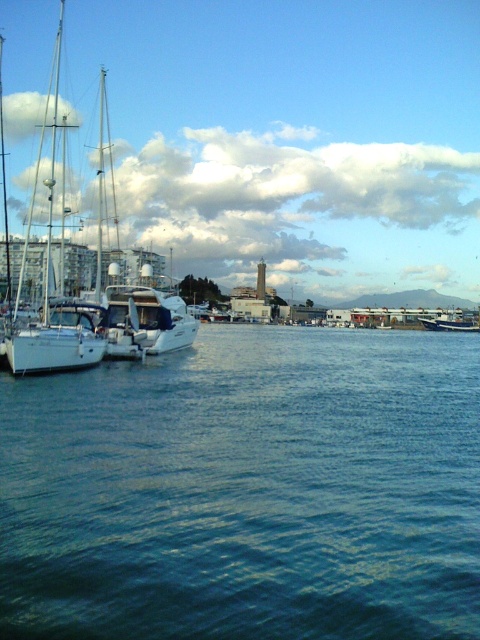
Question: Is blue water at center further to the viewer compared to white glossy sailboat at left?

Choices:
 (A) yes
 (B) no

Answer: (B)

Question: Is blue water at center thinner than white glossy sailboat at left?

Choices:
 (A) yes
 (B) no

Answer: (A)

Question: Can you confirm if blue water at center is bigger than blue glossy boat at right?

Choices:
 (A) yes
 (B) no

Answer: (A)

Question: Which point appears closest to the camera in this image?

Choices:
 (A) (154, 349)
 (B) (421, 323)

Answer: (A)

Question: Which object appears farthest from the camera in this image?

Choices:
 (A) blue glossy boat at right
 (B) white glossy sailboat at left
 (C) blue water at center

Answer: (A)

Question: Which point is closer to the camera?

Choices:
 (A) white glossy sailboat at left
 (B) blue water at center
 (C) blue glossy boat at right

Answer: (B)